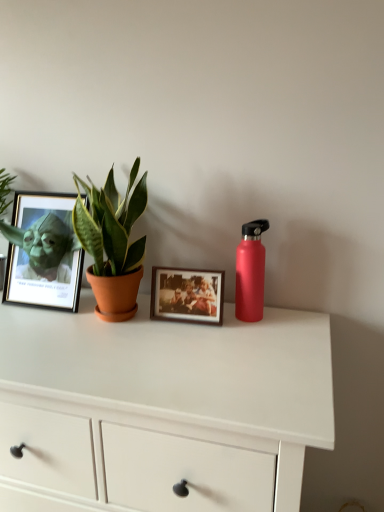
Question: Is matte red water bottle at right bigger than matte black frame at left, which is the 1th picture frame from left to right?

Choices:
 (A) yes
 (B) no

Answer: (B)

Question: From a real-world perspective, is matte red water bottle at right physically below matte black frame at left, the second picture frame in the right-to-left sequence?

Choices:
 (A) no
 (B) yes

Answer: (B)

Question: Is matte red water bottle at right at the right side of matte black frame at left, which is the 1th picture frame from left to right?

Choices:
 (A) no
 (B) yes

Answer: (B)

Question: Is matte red water bottle at right thinner than matte black frame at left, which is the 1th picture frame from left to right?

Choices:
 (A) yes
 (B) no

Answer: (A)

Question: From a real-world perspective, is matte red water bottle at right on matte black frame at left, which is the 1th picture frame from left to right?

Choices:
 (A) no
 (B) yes

Answer: (A)

Question: Is matte red water bottle at right completely or partially outside of matte black frame at left, the second picture frame in the right-to-left sequence?

Choices:
 (A) yes
 (B) no

Answer: (A)

Question: Does matte red water bottle at right appear on the left side of white matte chest of drawers at center?

Choices:
 (A) yes
 (B) no

Answer: (B)

Question: Is matte red water bottle at right oriented towards white matte chest of drawers at center?

Choices:
 (A) yes
 (B) no

Answer: (B)

Question: From the image's perspective, is matte red water bottle at right on white matte chest of drawers at center?

Choices:
 (A) no
 (B) yes

Answer: (B)

Question: Are matte red water bottle at right and white matte chest of drawers at center beside each other?

Choices:
 (A) yes
 (B) no

Answer: (B)

Question: Is matte red water bottle at right completely or partially outside of white matte chest of drawers at center?

Choices:
 (A) no
 (B) yes

Answer: (B)

Question: Is matte red water bottle at right not near white matte chest of drawers at center?

Choices:
 (A) no
 (B) yes

Answer: (A)

Question: Does matte black frame at left, which is the 1th picture frame from left to right, appear on the right side of white matte chest of drawers at center?

Choices:
 (A) yes
 (B) no

Answer: (B)